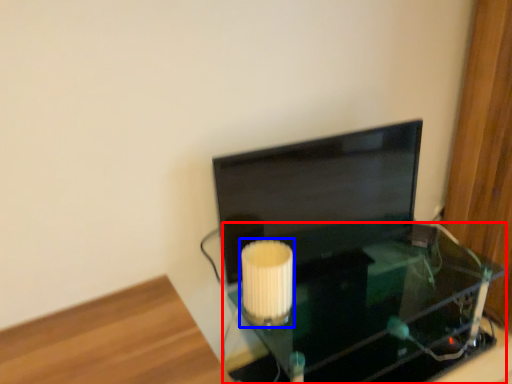
Question: Which of the following is the closest to the observer, table (highlighted by a red box) or lamp (highlighted by a blue box)?

Choices:
 (A) table
 (B) lamp

Answer: (A)